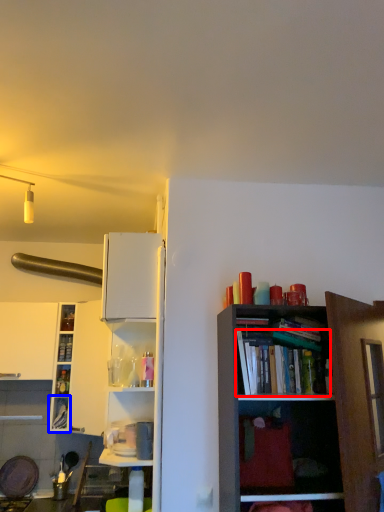
Question: Among these objects, which one is nearest to the camera, book (highlighted by a red box) or cabinet (highlighted by a blue box)?

Choices:
 (A) book
 (B) cabinet

Answer: (A)